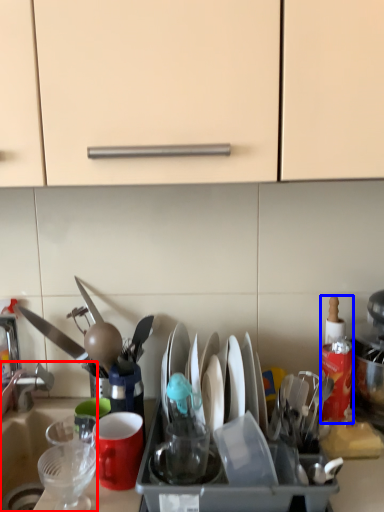
Question: Among these objects, which one is nearest to the camera, sink (highlighted by a red box) or bottle (highlighted by a blue box)?

Choices:
 (A) sink
 (B) bottle

Answer: (A)